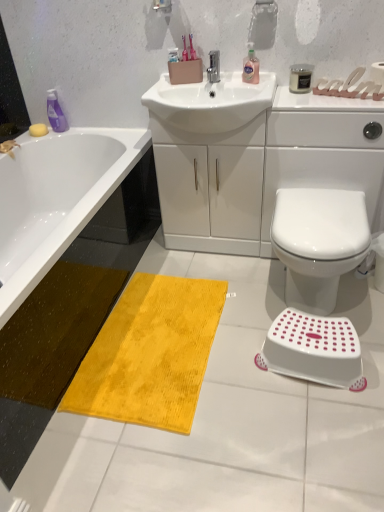
Where is `free space in front of white plastic step stool at lower right`? The image size is (384, 512). free space in front of white plastic step stool at lower right is located at coordinates (321, 426).